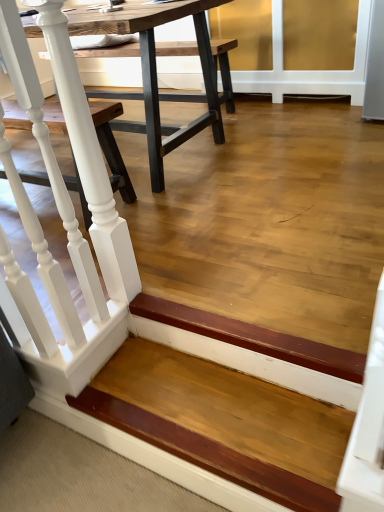
Where is `free space above wooden step at lower left (from a real-world perspective)`? The height and width of the screenshot is (512, 384). free space above wooden step at lower left (from a real-world perspective) is located at coordinates coord(207,405).